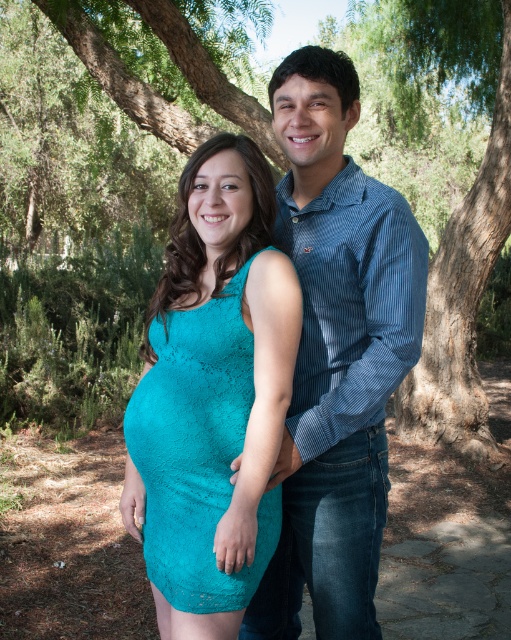
Can you confirm if blue striped shirt at center is bigger than green leafy tree at center?

No.

Who is more forward, (319, 196) or (142, 83)?

Point (319, 196) is more forward.

Between point (287, 65) and point (101, 115), which one is positioned in front?

Point (287, 65)

I want to click on blue striped shirt at center, so click(x=336, y=355).

Does blue striped shirt at center have a greater width compared to teal lace dress at center?

Yes.

Who is shorter, blue striped shirt at center or teal lace dress at center?

Standing shorter between the two is teal lace dress at center.

Is point (358, 563) farther from camera compared to point (172, 387)?

Yes, point (358, 563) is behind point (172, 387).

The image size is (511, 640). I want to click on blue striped shirt at center, so click(336, 355).

Is green leafy tree at center below teal lace dress at center?

No.

Is point (500, 196) farther from viewer compared to point (155, 465)?

Yes, point (500, 196) is behind point (155, 465).

Measure the distance between green leafy tree at center and camera.

green leafy tree at center is 5.67 meters away from camera.

This screenshot has height=640, width=511. Identify the location of green leafy tree at center. (78, 131).